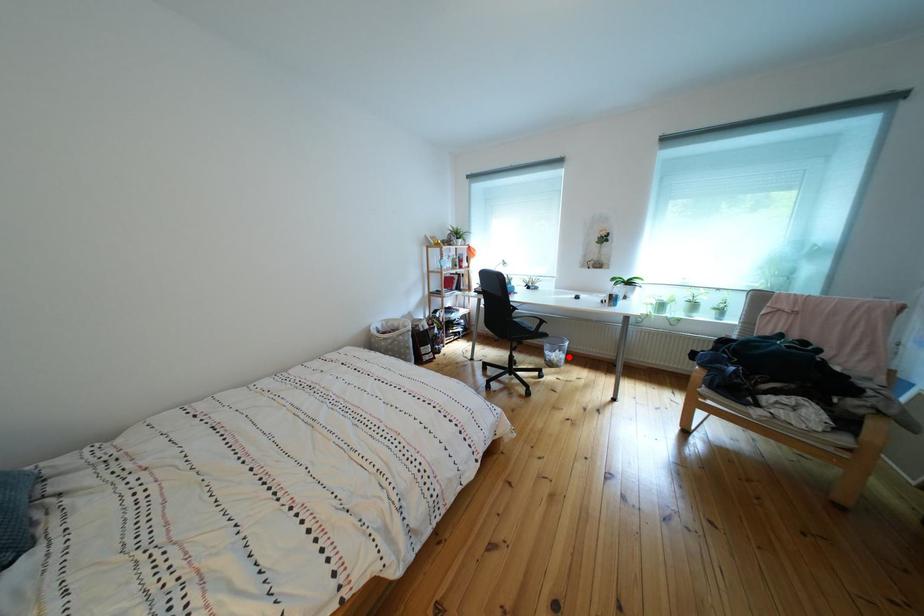
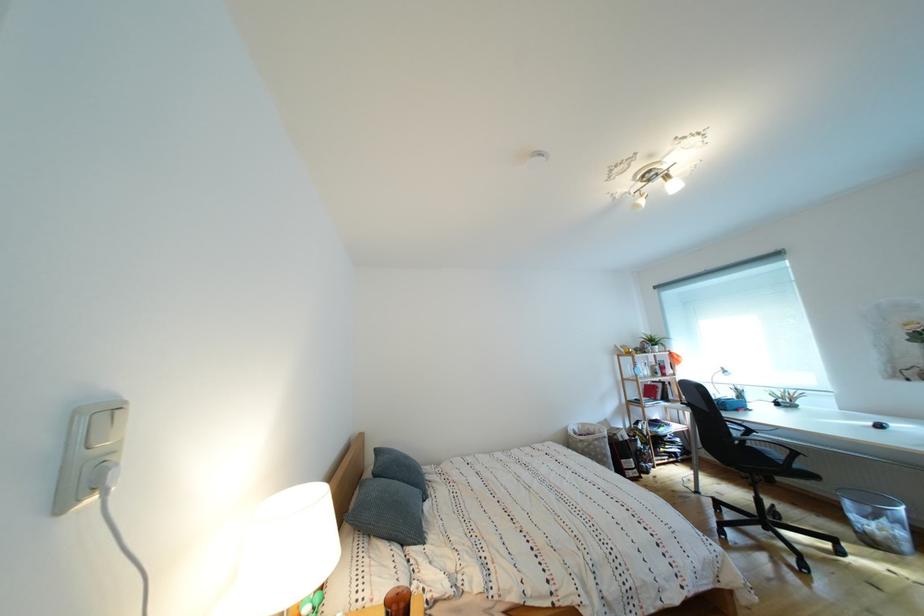
Question: I am providing you with two images of the same scene from different viewpoints. Image1 has a red point marked. In image2, the corresponding 3D location appears at what relative position? Reply with the corresponding letter.

Choices:
 (A) Closer
 (B) Farther

Answer: (A)